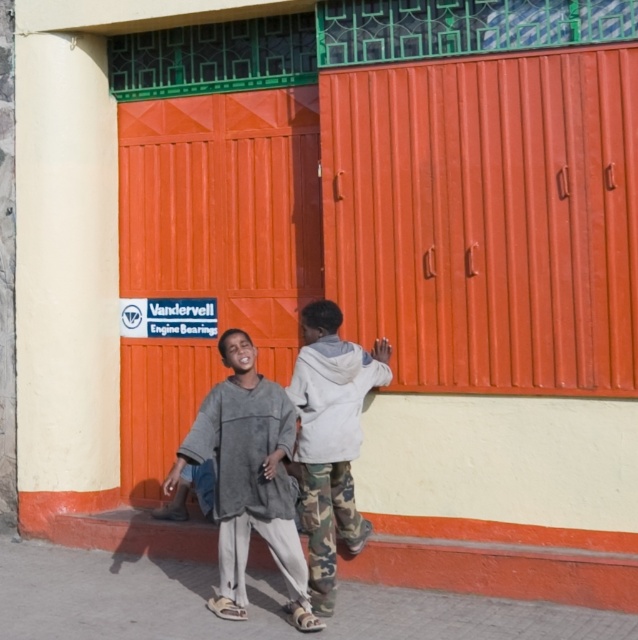
You are a delivery person trying to deliver a package to the orange corrugated metal door at center. The package requires a minimum width of 1.2 meters to fit through the door. If the camouflage pants at center are 0.5 meters wide, can the package be delivered through the door?

The orange corrugated metal door at center is wider than the camouflage pants at center, which are 0.5 meters wide. Since the door is wider than 0.5 meters, and the package requires a minimum of 1.2 meters, we need to confirm the door is at least that width. However, the exact width of the door isn not provided. Therefore, it is uncertain if the package can be delivered through the door based on the given information.

You are a delivery person trying to reach the orange corrugated metal door at center to drop off a package. There is a gray fleece sweater at lower left in the way. Can you walk around it to access the door?

The orange corrugated metal door at center is further to the viewer than gray fleece sweater at lower left, so the gray fleece sweater at lower left is closer to you. You can walk around the gray fleece sweater at lower left to access the door since it is closer and you can move around it.